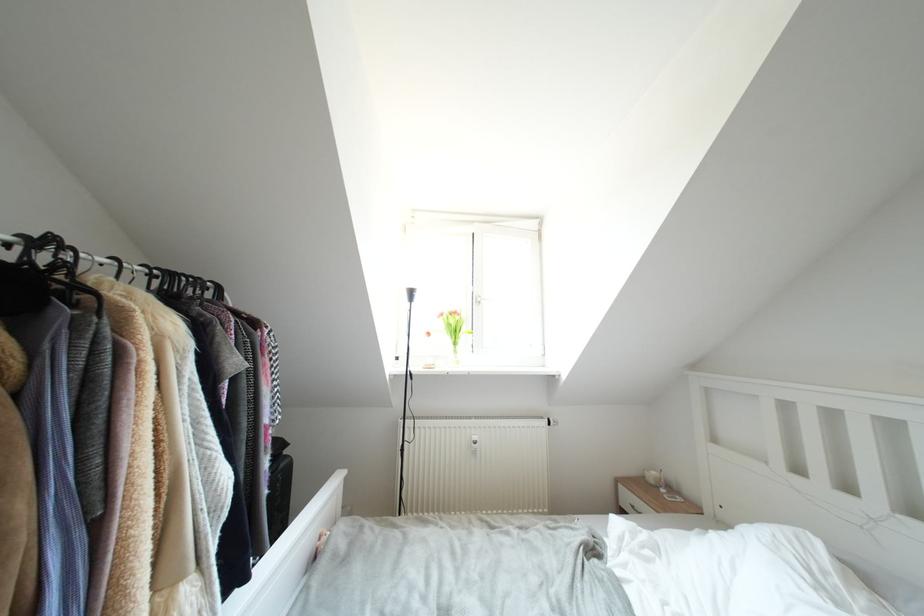
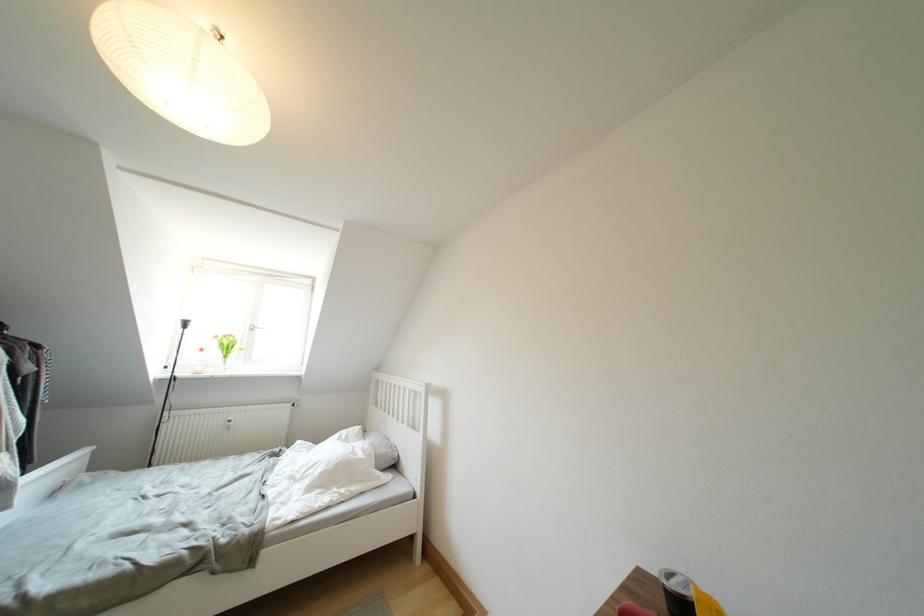
The point at [447,318] is marked in the first image. Where is the corresponding point in the second image?

(222, 341)